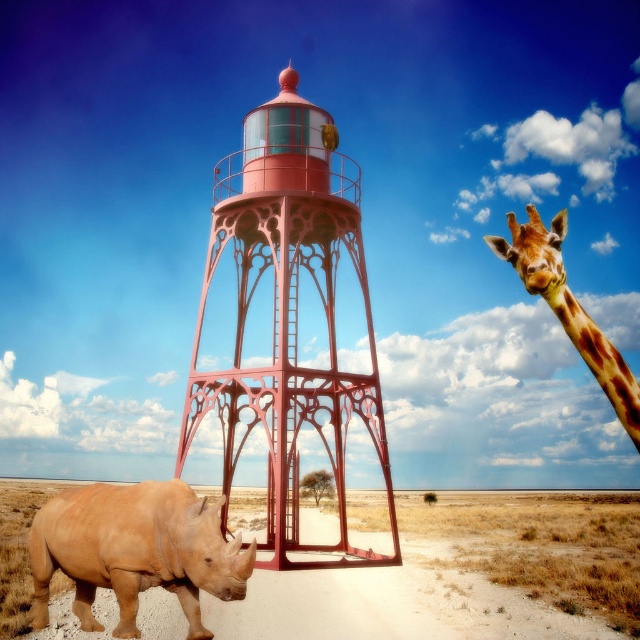
You are a traveler in the desert and want to take a photo of both the light brown matte rhinoceros at lower left and the spotted fur giraffe at upper right. Which animal should you zoom in more on to capture both in the frame?

You should zoom in more on the light brown matte rhinoceros at lower left because it is smaller in size compared to the spotted fur giraffe at upper right, allowing both to fit in the frame.

You are a wildlife photographer planning to take a photo of the light brown matte rhinoceros at lower left and the spotted fur giraffe at upper right in the desert scene. Your camera has a maximum focus range of 20 meters. Will you be able to capture both animals clearly in one shot without moving the camera?

The light brown matte rhinoceros at lower left and the spotted fur giraffe at upper right are 23.76 meters apart from each other. Since the camera can only focus up to 20 meters, it will not be able to capture both animals clearly in one shot without moving the camera.